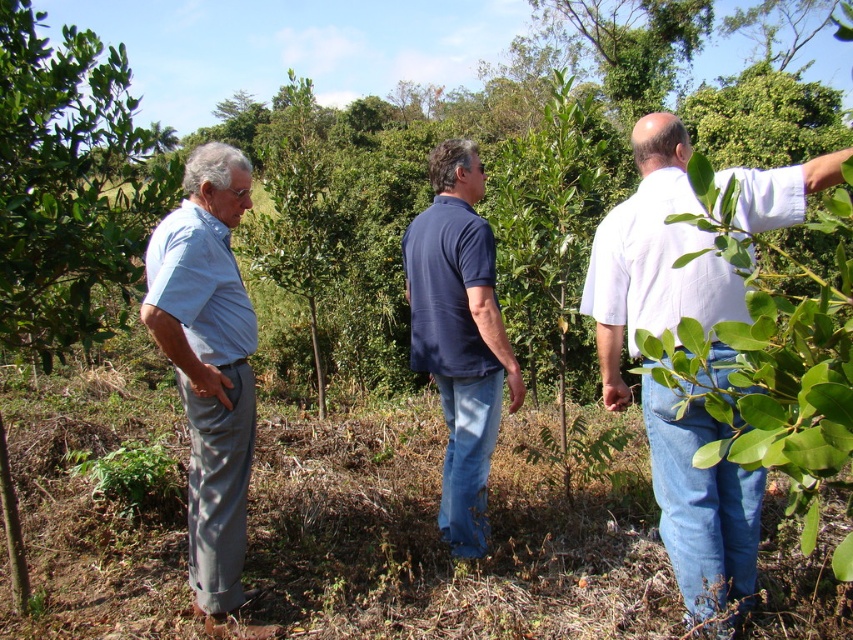
Can you confirm if green leafy tree at left is bigger than navy blue shirt at center?

Indeed, green leafy tree at left has a larger size compared to navy blue shirt at center.

Between point (77, 113) and point (463, 493), which one is positioned in front?

Point (77, 113) is more forward.

Find the location of `green leafy tree at left`. green leafy tree at left is located at coordinates (70, 186).

Is point (1, 125) behind point (204, 342)?

Yes.

Locate an element on the screen. This screenshot has width=853, height=640. green leafy tree at left is located at coordinates (70, 186).

Can you confirm if white cotton shirt at right is wider than light blue cotton shirt at left?

Indeed, white cotton shirt at right has a greater width compared to light blue cotton shirt at left.

Who is positioned more to the left, white cotton shirt at right or light blue cotton shirt at left?

light blue cotton shirt at left

Does point (611, 381) lie in front of point (213, 440)?

That is False.

Where is `white cotton shirt at right`? The width and height of the screenshot is (853, 640). white cotton shirt at right is located at coordinates (654, 259).